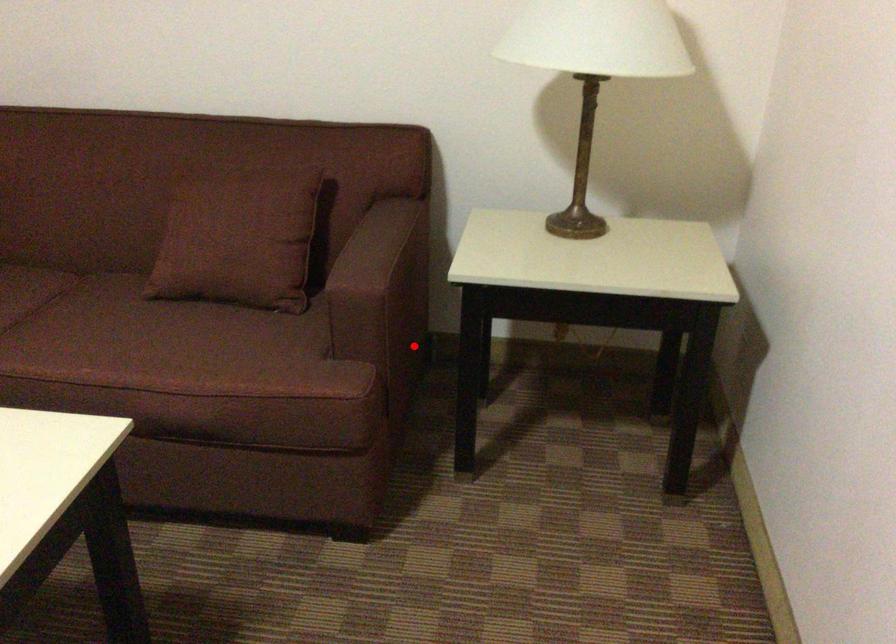
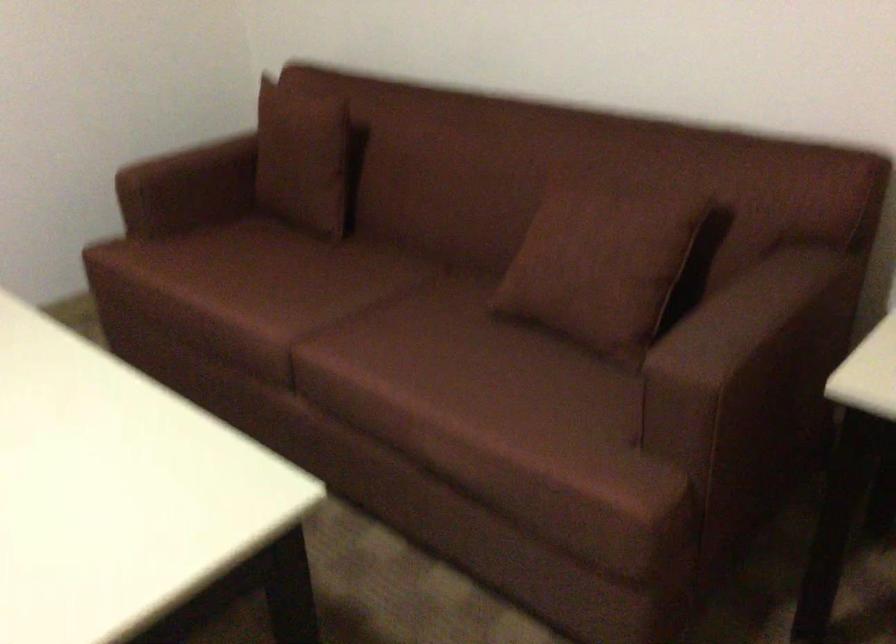
Question: I am providing you with two images of the same scene from different viewpoints. In image1, a red point is highlighted. Considering the same 3D point in image2, which of the following is correct?

Choices:
 (A) It is closer
 (B) It is farther

Answer: (A)